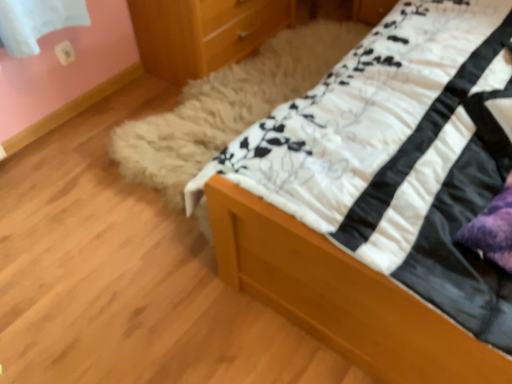
Question: From a real-world perspective, is white soft quilt at upper right positioned above or below wooden chest of drawers at upper center?

Choices:
 (A) below
 (B) above

Answer: (A)

Question: Considering the positions of point [x=371, y=99] and point [x=266, y=1], is point [x=371, y=99] closer or farther from the camera than point [x=266, y=1]?

Choices:
 (A) farther
 (B) closer

Answer: (B)

Question: Considering the positions of white soft quilt at upper right and wooden chest of drawers at upper center in the image, is white soft quilt at upper right bigger or smaller than wooden chest of drawers at upper center?

Choices:
 (A) small
 (B) big

Answer: (B)

Question: Is point (181, 64) positioned closer to the camera than point (436, 317)?

Choices:
 (A) closer
 (B) farther

Answer: (B)

Question: Would you say wooden chest of drawers at upper center is inside or outside white soft quilt at upper right?

Choices:
 (A) outside
 (B) inside

Answer: (A)

Question: From a real-world perspective, is wooden chest of drawers at upper center physically located above or below white soft quilt at upper right?

Choices:
 (A) above
 (B) below

Answer: (A)

Question: Considering the positions of wooden chest of drawers at upper center and white soft quilt at upper right in the image, is wooden chest of drawers at upper center bigger or smaller than white soft quilt at upper right?

Choices:
 (A) big
 (B) small

Answer: (B)